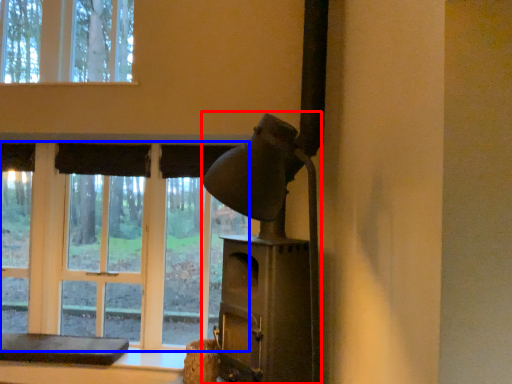
Question: Which object appears closest to the camera in this image, fireplace (highlighted by a red box) or bay window (highlighted by a blue box)?

Choices:
 (A) fireplace
 (B) bay window

Answer: (A)